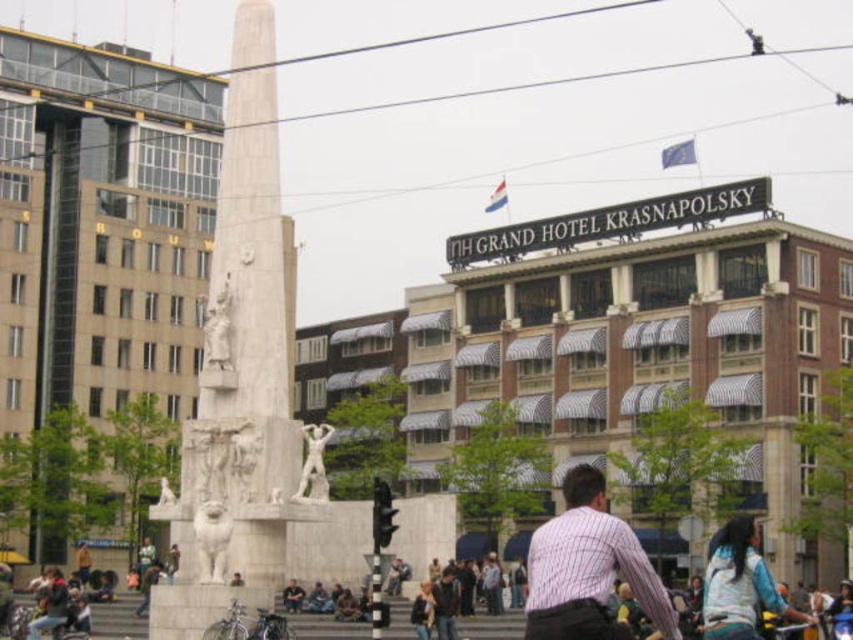
Question: Is white marble monument at center smaller than silver metallic bicycle at lower center?

Choices:
 (A) no
 (B) yes

Answer: (A)

Question: Does white marble monument at center have a greater width compared to blue denim jacket at lower right?

Choices:
 (A) no
 (B) yes

Answer: (B)

Question: Is silver metallic bicycle at lower center below white marble statue at center?

Choices:
 (A) no
 (B) yes

Answer: (B)

Question: Among these points, which one is nearest to the camera?

Choices:
 (A) (599, 550)
 (B) (283, 620)
 (C) (747, 593)
 (D) (312, 461)

Answer: (A)

Question: Which object appears closest to the camera in this image?

Choices:
 (A) blue denim jacket at lower right
 (B) white marble monument at center
 (C) striped cotton shirt at center
 (D) silver metallic bicycle at lower center

Answer: (C)

Question: Based on their relative distances, which object is farther from the blue denim jacket at lower right?

Choices:
 (A) white marble statue at center
 (B) white marble monument at center

Answer: (B)